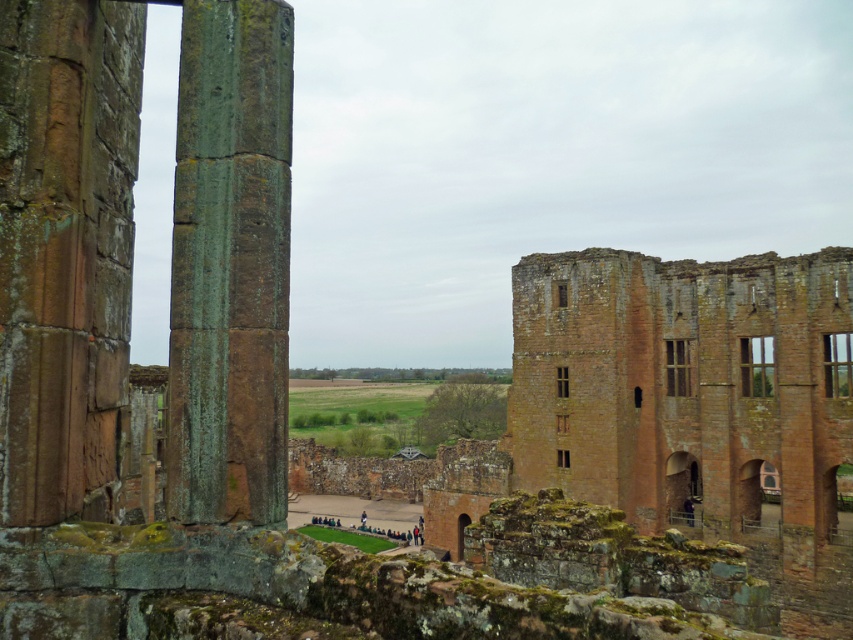
You are an architect examining the ruins and need to compare the sizes of the matte brown wooden window at upper right and the dark blue fabric at lower right. Which object has a smaller width?

The matte brown wooden window at upper right has a smaller width than the dark blue fabric at lower right.

You are an architect visiting the ruins and notice the wooden window at center and dark blue fabric at center. Which object is taller?

The wooden window at center is much taller than the dark blue fabric at center.

Consider the image. You are an architect examining the ruins and notice the wooden window at center and the dark blue fabric at center. From the perspective of someone standing in the courtyard, which object is positioned to the right?

The wooden window at center is to the right of the dark blue fabric at center.